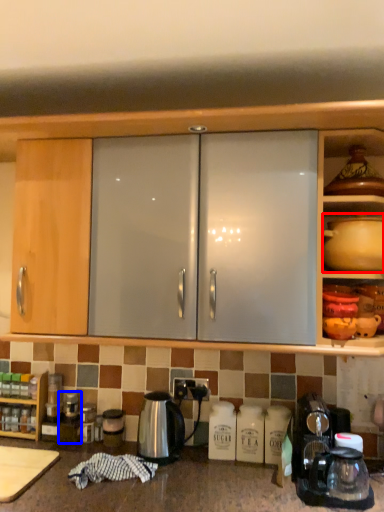
Question: Which point is closer to the camera, coffeepot (highlighted by a red box) or appliance (highlighted by a blue box)?

Choices:
 (A) coffeepot
 (B) appliance

Answer: (A)